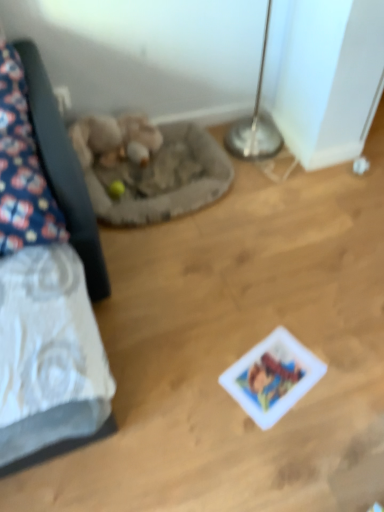
Question: From the image's perspective, is gray fabric cat bed at center-left located beneath fluffy fabric pillow at left?

Choices:
 (A) yes
 (B) no

Answer: (A)

Question: Does gray fabric cat bed at center-left have a greater width compared to fluffy fabric pillow at left?

Choices:
 (A) no
 (B) yes

Answer: (A)

Question: From a real-world perspective, is gray fabric cat bed at center-left located beneath fluffy fabric pillow at left?

Choices:
 (A) yes
 (B) no

Answer: (A)

Question: Would you say gray fabric cat bed at center-left is a long distance from fluffy fabric pillow at left?

Choices:
 (A) no
 (B) yes

Answer: (A)

Question: Considering the relative sizes of gray fabric cat bed at center-left and fluffy fabric pillow at left in the image provided, is gray fabric cat bed at center-left shorter than fluffy fabric pillow at left?

Choices:
 (A) yes
 (B) no

Answer: (A)

Question: Could fluffy fabric pillow at left be considered to be inside gray fabric cat bed at center-left?

Choices:
 (A) yes
 (B) no

Answer: (B)

Question: Can you confirm if white glossy card at center is positioned to the left of gray fabric cat bed at center-left?

Choices:
 (A) yes
 (B) no

Answer: (B)

Question: Would you say gray fabric cat bed at center-left is part of white glossy card at center's contents?

Choices:
 (A) no
 (B) yes

Answer: (A)

Question: From the image's perspective, is white glossy card at center above gray fabric cat bed at center-left?

Choices:
 (A) no
 (B) yes

Answer: (A)

Question: Does white glossy card at center appear on the right side of gray fabric cat bed at center-left?

Choices:
 (A) yes
 (B) no

Answer: (A)

Question: From the image's perspective, is white glossy card at center under gray fabric cat bed at center-left?

Choices:
 (A) yes
 (B) no

Answer: (A)

Question: From a real-world perspective, is white glossy card at center physically below gray fabric cat bed at center-left?

Choices:
 (A) yes
 (B) no

Answer: (A)

Question: From a real-world perspective, does fuzzy beige stuffed animal at center-left sit lower than gray fabric cat bed at center-left?

Choices:
 (A) no
 (B) yes

Answer: (A)